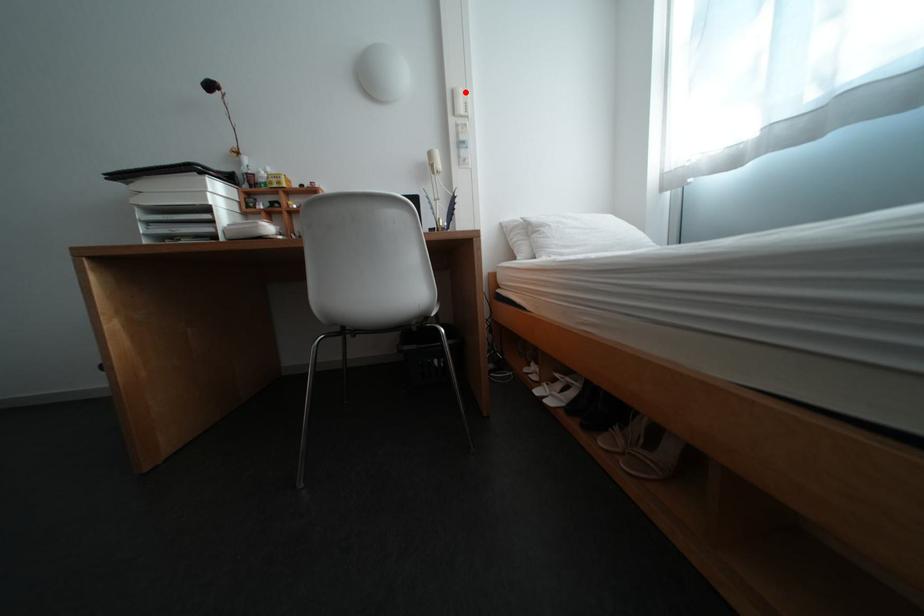
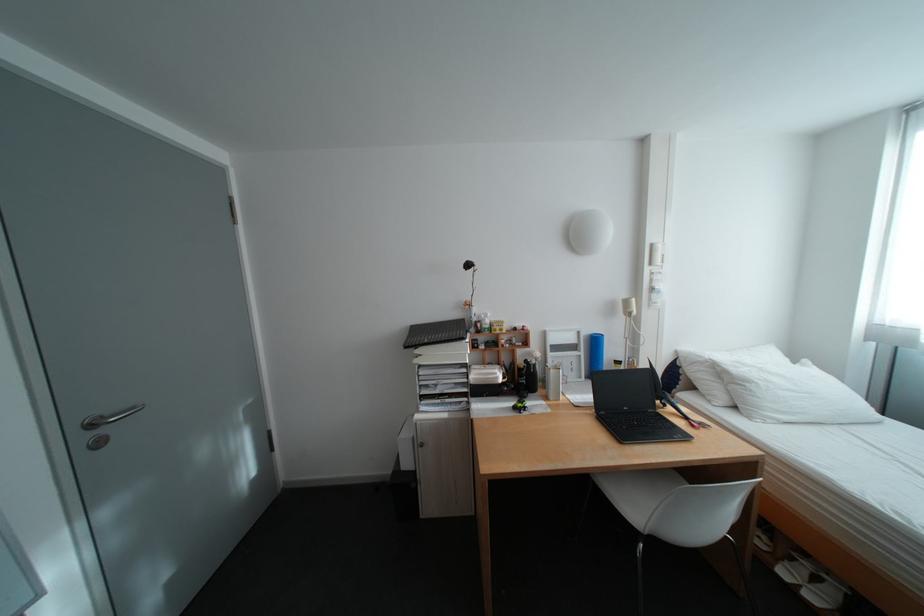
Question: I am providing you with two images of the same scene from different viewpoints. A red point is shown in image1. For the corresponding object point in image2, is it positioned nearer or farther from the camera?

Choices:
 (A) Nearer
 (B) Farther

Answer: (B)